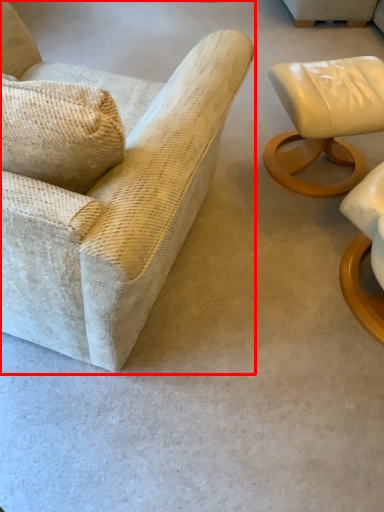
Question: From the image's perspective, considering the relative positions of chair (annotated by the red box) and chair in the image provided, where is chair (annotated by the red box) located with respect to the staircase?

Choices:
 (A) above
 (B) below

Answer: (B)